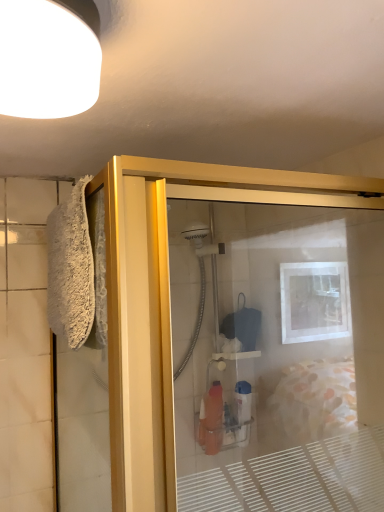
Question: Is white fluffy bath towel at left bigger than gold metallic shower door at left?

Choices:
 (A) yes
 (B) no

Answer: (B)

Question: Considering the relative positions of white fluffy bath towel at left and gold metallic shower door at left in the image provided, is white fluffy bath towel at left in front of gold metallic shower door at left?

Choices:
 (A) yes
 (B) no

Answer: (B)

Question: From a real-world perspective, is white fluffy bath towel at left on gold metallic shower door at left?

Choices:
 (A) yes
 (B) no

Answer: (A)

Question: Does white fluffy bath towel at left appear on the right side of gold metallic shower door at left?

Choices:
 (A) no
 (B) yes

Answer: (A)

Question: Can you confirm if white fluffy bath towel at left is wider than gold metallic shower door at left?

Choices:
 (A) no
 (B) yes

Answer: (A)

Question: From a real-world perspective, relative to white matte light fixture at upper left, is gold metallic shower door at left vertically above or below?

Choices:
 (A) below
 (B) above

Answer: (A)

Question: Does point (380, 307) appear closer or farther from the camera than point (82, 73)?

Choices:
 (A) farther
 (B) closer

Answer: (A)

Question: Considering the positions of gold metallic shower door at left and white matte light fixture at upper left in the image, is gold metallic shower door at left wider or thinner than white matte light fixture at upper left?

Choices:
 (A) wide
 (B) thin

Answer: (A)

Question: Considering the positions of gold metallic shower door at left and white matte light fixture at upper left in the image, is gold metallic shower door at left taller or shorter than white matte light fixture at upper left?

Choices:
 (A) short
 (B) tall

Answer: (B)

Question: Is white matte light fixture at upper left inside or outside of gold metallic shower door at left?

Choices:
 (A) inside
 (B) outside

Answer: (B)

Question: Is point (31, 16) closer or farther from the camera than point (210, 507)?

Choices:
 (A) farther
 (B) closer

Answer: (B)

Question: Looking at the image, does white matte light fixture at upper left seem bigger or smaller compared to gold metallic shower door at left?

Choices:
 (A) small
 (B) big

Answer: (A)

Question: Visually, is white matte light fixture at upper left positioned to the left or to the right of gold metallic shower door at left?

Choices:
 (A) left
 (B) right

Answer: (A)

Question: Is gold metallic shower door at left bigger or smaller than white fluffy bath towel at left?

Choices:
 (A) small
 (B) big

Answer: (B)

Question: Is gold metallic shower door at left inside the boundaries of white fluffy bath towel at left, or outside?

Choices:
 (A) outside
 (B) inside

Answer: (A)